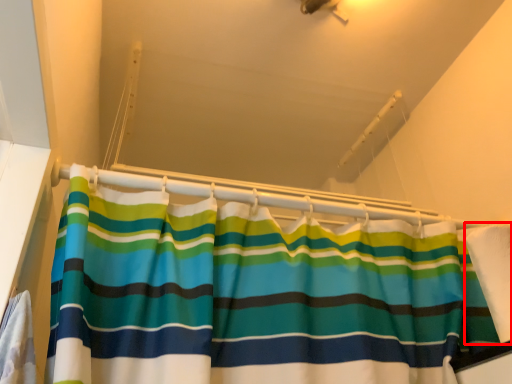
Question: In this image, where is fabric (annotated by the red box) located relative to balustrade?

Choices:
 (A) left
 (B) right

Answer: (B)